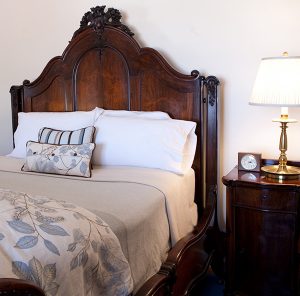
Where is `wall`? This screenshot has height=296, width=300. wall is located at coordinates (251, 91).